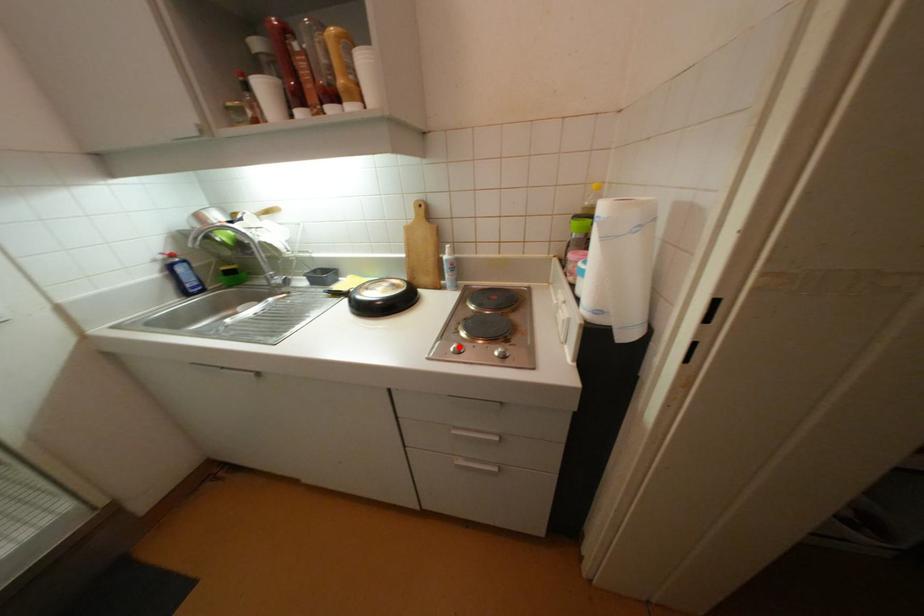
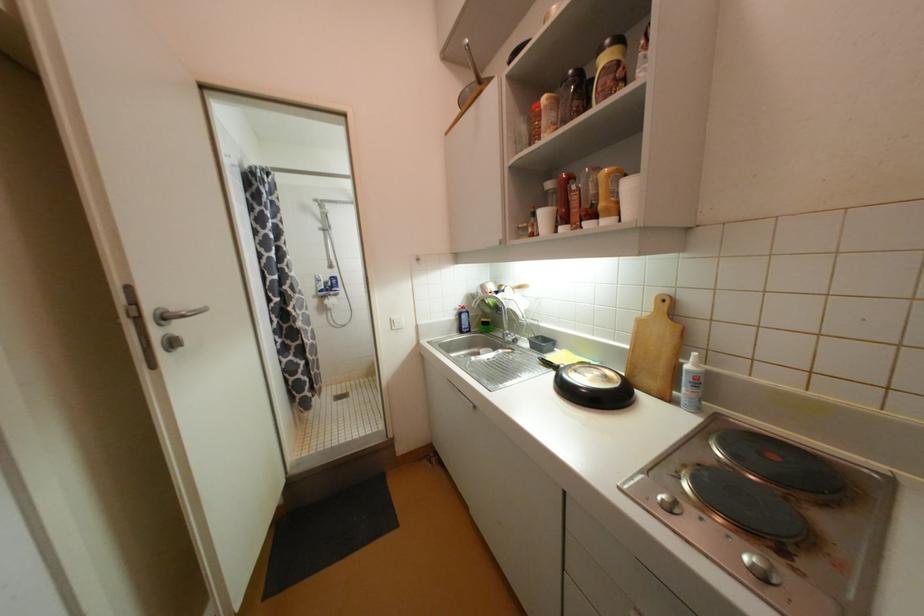
Locate, in the second image, the point that corresponds to the highlighted location in the first image.

(669, 498)